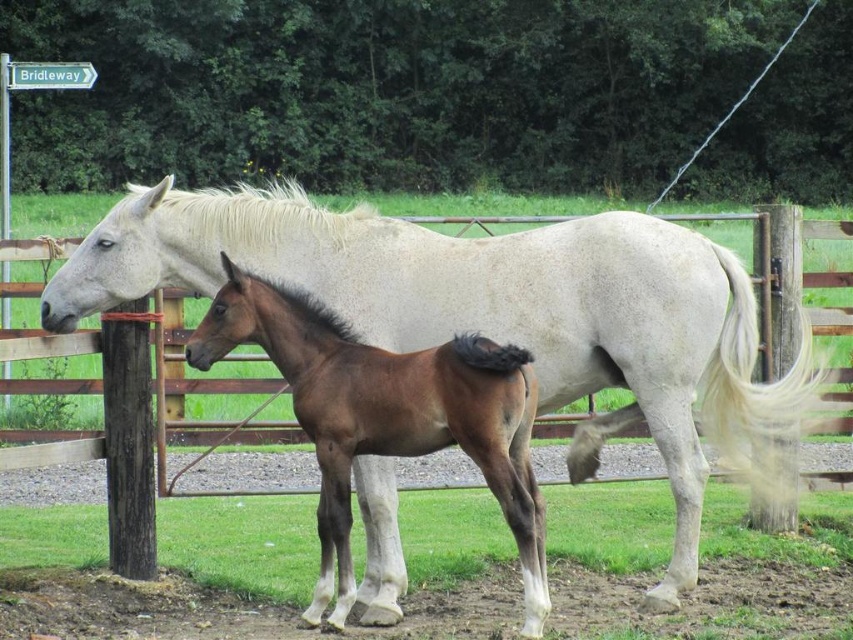
Can you confirm if white matte horse at center is positioned above brown glossy horse at center?

Yes.

Is white matte horse at center thinner than brown glossy horse at center?

Indeed, white matte horse at center has a lesser width compared to brown glossy horse at center.

Is point (97, 305) in front of point (323, 481)?

That is False.

At what (x,y) coordinates should I click in order to perform the action: click on white matte horse at center. Please return your answer as a coordinate pair (x, y). The image size is (853, 640). Looking at the image, I should click on (496, 314).